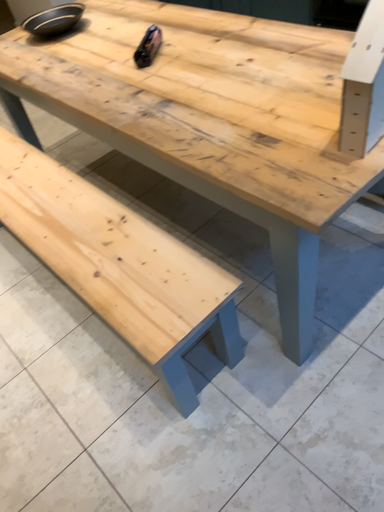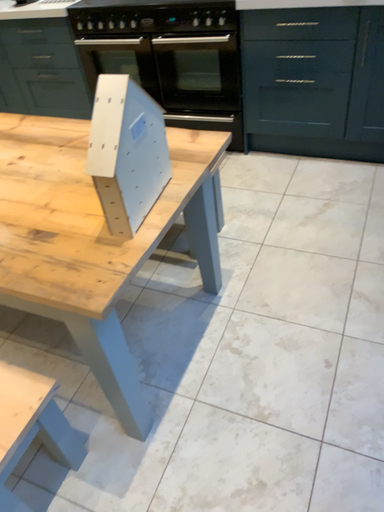
Question: How did the camera likely rotate when shooting the video?

Choices:
 (A) rotated downward
 (B) rotated upward

Answer: (B)